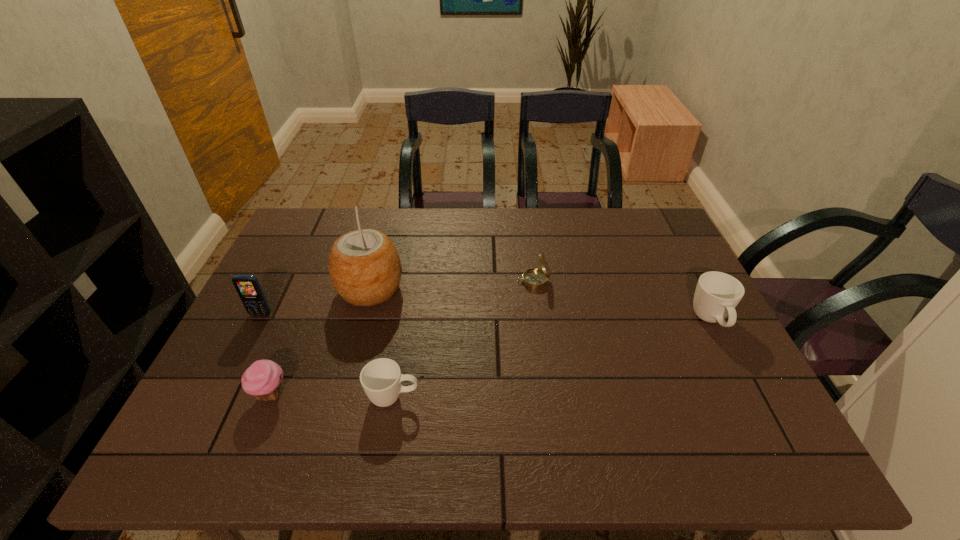
You are a GUI agent. You are given a task and a screenshot of the screen. Output one action in this format:
    pyautogui.click(x=<x>, y=<y>)
    Task: Click on the left cup
    
    Given the screenshot: What is the action you would take?
    click(x=381, y=378)

Find the location of a particular element. Image resolution: width=960 pixels, height=540 pixels. the shorter cup is located at coordinates (381, 378).

Find the location of a particular element. The width and height of the screenshot is (960, 540). the rightmost object is located at coordinates (717, 294).

Find the location of a particular element. This screenshot has width=960, height=540. the farther cup is located at coordinates (717, 294).

This screenshot has height=540, width=960. Identify the location of cellular telephone. (248, 288).

Identify the location of the leftmost object. (248, 288).

Locate an element on the screen. compass is located at coordinates (534, 278).

Find the location of a particular element. The image size is (960, 540). the tallest object is located at coordinates (365, 267).

You are a GUI agent. You are given a task and a screenshot of the screen. Output one action in this format:
    pyautogui.click(x=<x>, y=<y>)
    Task: Click on the fifth object from right to left
    The image size is (960, 540).
    Given the screenshot: What is the action you would take?
    pyautogui.click(x=262, y=379)

This screenshot has height=540, width=960. I want to click on vacant space situated 0.050m with the handle on the side of the left cup, so click(443, 397).